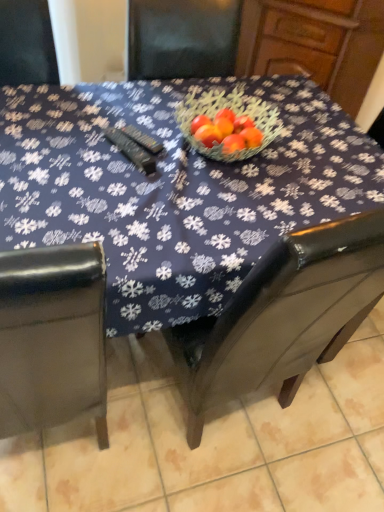
Question: Can you confirm if brown leather chair at lower right is smaller than blue fabric table at center?

Choices:
 (A) yes
 (B) no

Answer: (A)

Question: Does brown leather chair at lower right have a greater height compared to blue fabric table at center?

Choices:
 (A) no
 (B) yes

Answer: (A)

Question: Considering the relative sizes of brown leather chair at lower right and blue fabric table at center in the image provided, is brown leather chair at lower right shorter than blue fabric table at center?

Choices:
 (A) no
 (B) yes

Answer: (B)

Question: Does brown leather chair at lower right come in front of blue fabric table at center?

Choices:
 (A) yes
 (B) no

Answer: (B)

Question: Is brown leather chair at lower right looking in the opposite direction of blue fabric table at center?

Choices:
 (A) no
 (B) yes

Answer: (A)

Question: Can you confirm if brown leather chair at lower right is wider than blue fabric table at center?

Choices:
 (A) yes
 (B) no

Answer: (A)

Question: From a real-world perspective, is blue fabric table at center over brown leather chair at lower right?

Choices:
 (A) no
 (B) yes

Answer: (B)

Question: Can you confirm if blue fabric table at center is positioned to the right of brown leather chair at lower right?

Choices:
 (A) yes
 (B) no

Answer: (B)

Question: Is blue fabric table at center bigger than brown leather chair at lower right?

Choices:
 (A) no
 (B) yes

Answer: (B)

Question: Is blue fabric table at center to the left of brown leather chair at lower right from the viewer's perspective?

Choices:
 (A) no
 (B) yes

Answer: (B)

Question: Is blue fabric table at center further to the viewer compared to brown leather chair at lower right?

Choices:
 (A) yes
 (B) no

Answer: (B)

Question: Is blue fabric table at center closer to the viewer compared to brown leather chair at lower right?

Choices:
 (A) no
 (B) yes

Answer: (B)

Question: Is blue fabric table at center to the left or to the right of brown leather chair at lower right in the image?

Choices:
 (A) left
 (B) right

Answer: (A)